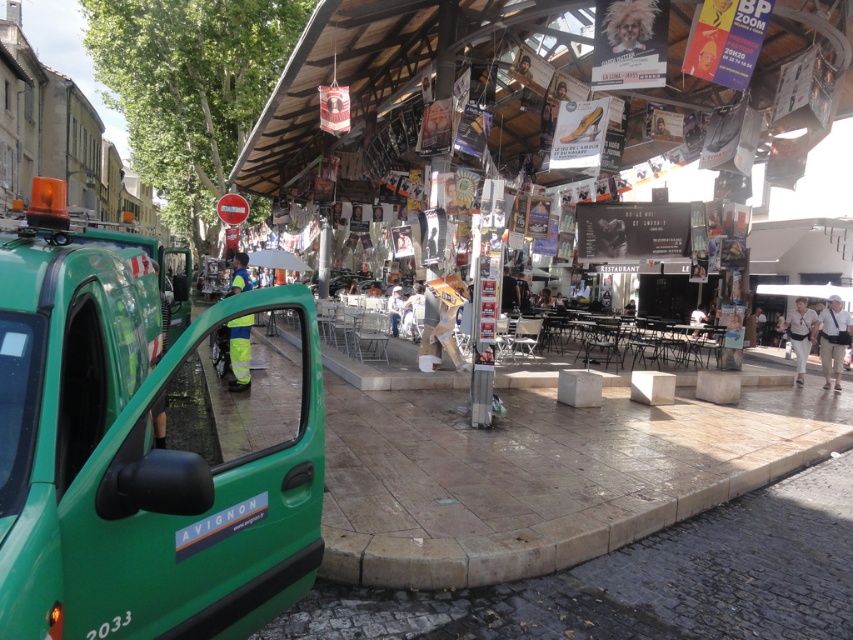
You are a delivery person standing at the entrance of the restaurant. You need to place a package on the white fabric bag at lower right. Can you reach the point at coordinates (799, 333) on the white fabric bag at lower right with your arm? Assume your arm can reach up to 1.5 meters.

The point at coordinates (799, 333) on the white fabric bag at lower right is within the reach of your arm since it is located on the lower part of the bag, and your arm can extend up to 1.5 meters.

You are a photographer taking a picture of the scene. You notice the curly blonde hair at upper center and the light blue shirt at center. Which object should you adjust your camera focus to ensure both are in frame? Explain your reasoning.

The curly blonde hair at upper center is positioned on the left side of light blue shirt at center. To ensure both are in frame, adjust the camera focus to include the area where both objects are located, as they are positioned next to each other with the curly blonde hair at upper center on the left and the light blue shirt at center on the right.